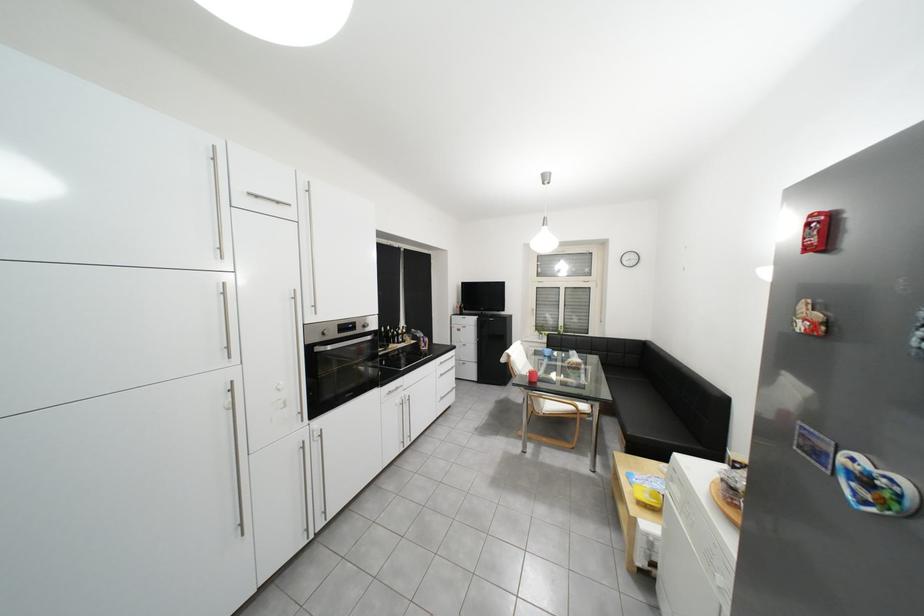
You are a GUI agent. You are given a task and a screenshot of the screen. Output one action in this format:
    pyautogui.click(x=<x>, y=<y>)
    Task: Click on the sofa sitting surface
    The image size is (924, 616).
    Given the screenshot: What is the action you would take?
    pyautogui.click(x=648, y=418)